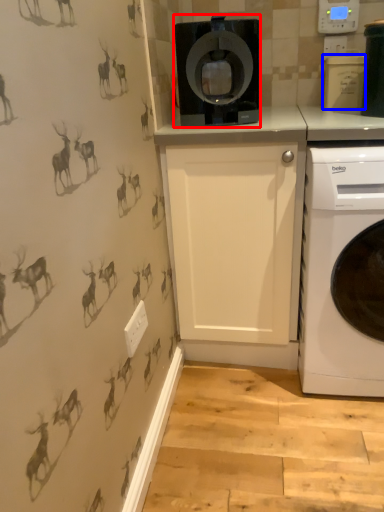
Question: Which of the following is the farthest to the observer, home appliance (highlighted by a red box) or appliance (highlighted by a blue box)?

Choices:
 (A) home appliance
 (B) appliance

Answer: (B)